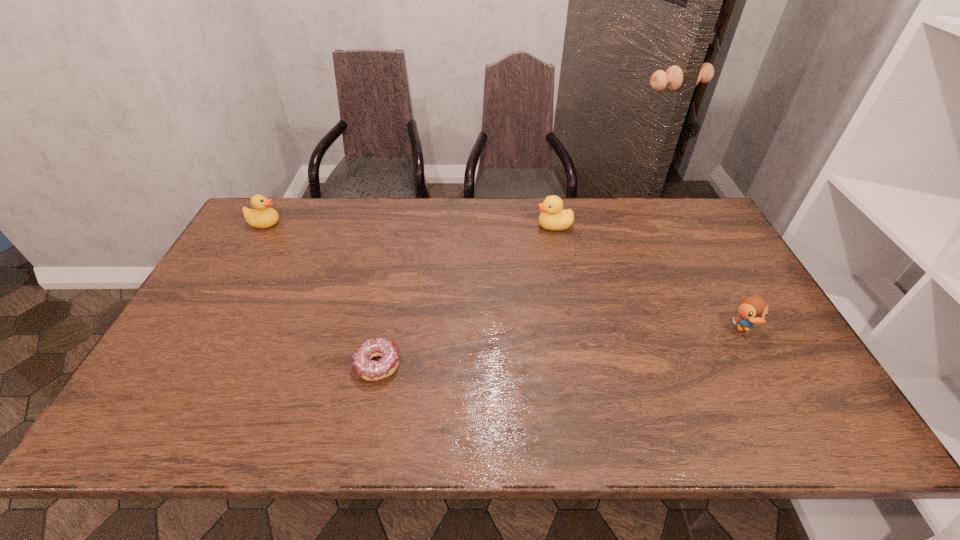
Image resolution: width=960 pixels, height=540 pixels. I want to click on unoccupied position between the leftmost duck and the third object from left to right, so click(x=409, y=225).

At what (x,y) coordinates should I click in order to perform the action: click on vacant area that lies between the leftmost duck and the third object from left to right. Please return your answer as a coordinate pair (x, y). Looking at the image, I should click on (409, 225).

I want to click on free space between the leftmost object and the nearest object, so click(x=322, y=294).

This screenshot has width=960, height=540. I want to click on vacant area between the leftmost object and the third object from left to right, so click(409, 225).

Locate an element on the screen. This screenshot has height=540, width=960. free point between the second duck from right to left and the leftmost object is located at coordinates (x=409, y=225).

Where is `vacant point located between the leftmost duck and the nearest object`? vacant point located between the leftmost duck and the nearest object is located at coordinates (322, 294).

Find the location of `empty space that is in between the second object from left to right and the nearest duck`. empty space that is in between the second object from left to right and the nearest duck is located at coordinates (561, 347).

I want to click on free spot between the leftmost duck and the nearest object, so click(322, 294).

At what (x,y) coordinates should I click in order to perform the action: click on free space that is in between the rightmost object and the second object from right to left. Please return your answer as a coordinate pair (x, y). Image resolution: width=960 pixels, height=540 pixels. Looking at the image, I should click on (649, 277).

In order to click on vacant area that lies between the nearest duck and the leftmost duck in this screenshot , I will do `click(504, 276)`.